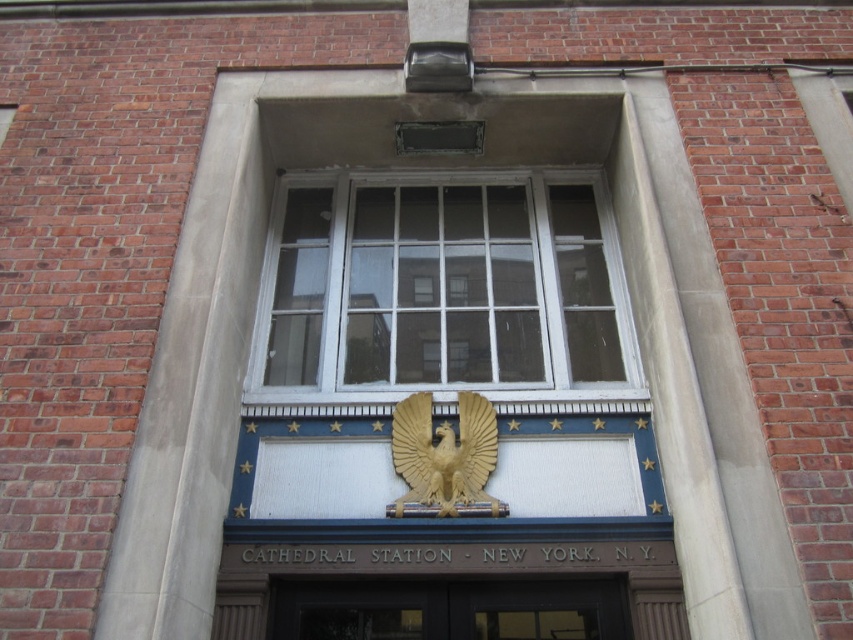
You are standing in front of the building and want to enter through the matte black door at center. However, the white wood window at center is blocking your view of the door. Can you walk around the window to access the door?

The matte black door at center is behind the white wood window at center, so you cannot walk around the window to access the door because the door is positioned behind the window and not to the side.

You are a painter who needs to decide whether to use a ladder or a step stool for a project. You are currently looking at the white wood window at center and the matte black door at center. Which object requires the ladder because it is taller?

The white wood window at center is much taller than the matte black door at center, so the ladder is needed for the white wood window at center.

You are standing in front of a building with a red brick wall and a window framed by light gray stone. There is a golden eagle emblem below the window. A point with coordinates point (444, 289) is mentioned. Which object from the scene does this point belong to?

The point (444, 289) is on the white wood window at center.